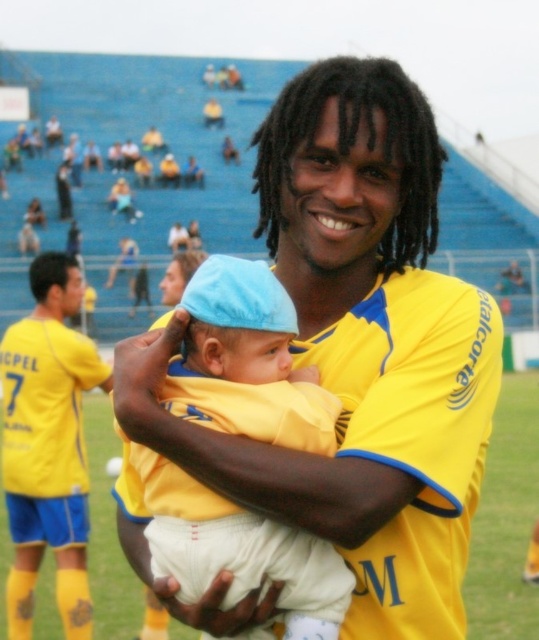
Is yellow jersey at center further to the viewer compared to light blue fabric hat at center?

Yes.

Where is `yellow jersey at center`? The image size is (539, 640). yellow jersey at center is located at coordinates (357, 349).

Is point (418, 330) more distant than point (71, 451)?

No, it is not.

Does yellow jersey at center lie in front of yellow jersey at left?

Yes, yellow jersey at center is closer to the viewer.

Which is behind, point (448, 604) or point (5, 481)?

The point (5, 481) is more distant.

Identify the location of yellow jersey at center. This screenshot has height=640, width=539. (357, 349).

Does yellow jersey at left lie behind yellow fabric baby at center?

No, yellow jersey at left is closer to the viewer.

Between yellow jersey at left and yellow fabric baby at center, which one is positioned lower?

yellow fabric baby at center is below.

You are a GUI agent. You are given a task and a screenshot of the screen. Output one action in this format:
    pyautogui.click(x=<x>, y=<y>)
    Task: Click on the yellow jersey at left
    The width and height of the screenshot is (539, 640).
    Given the screenshot: What is the action you would take?
    pyautogui.click(x=47, y=445)